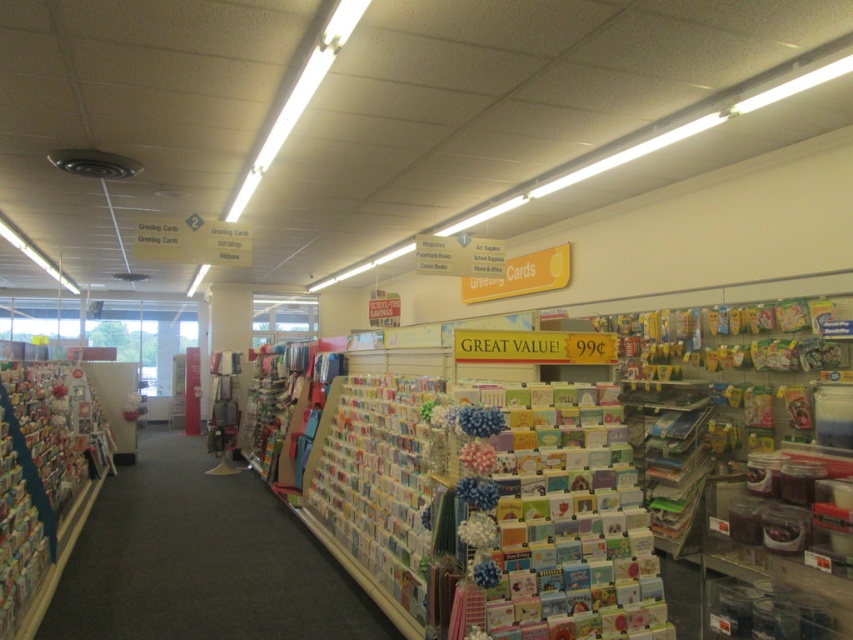
Question: Can you confirm if white paper greeting cards at center is positioned to the right of cardboard greeting cards at left?

Choices:
 (A) yes
 (B) no

Answer: (A)

Question: Which object is closer to the camera taking this photo?

Choices:
 (A) cardboard greeting cards at left
 (B) white paper greeting cards at center

Answer: (A)

Question: Which point is farther from the camera taking this photo?

Choices:
 (A) (219, 612)
 (B) (9, 417)

Answer: (B)

Question: Can you confirm if white paper greeting cards at center is positioned below cardboard greeting cards at left?

Choices:
 (A) no
 (B) yes

Answer: (B)

Question: Does white paper greeting cards at center have a lesser width compared to cardboard greeting cards at left?

Choices:
 (A) yes
 (B) no

Answer: (B)

Question: Which point is closer to the camera taking this photo?

Choices:
 (A) (233, 515)
 (B) (22, 605)

Answer: (B)